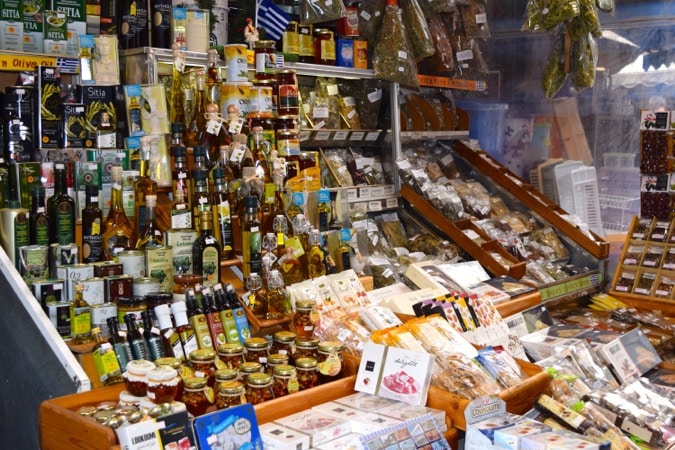
You are a GUI agent. You are given a task and a screenshot of the screen. Output one action in this format:
    pyautogui.click(x=<x>, y=<y>)
    Task: Click on the plastic baskets
    The height and width of the screenshot is (450, 675).
    Given the screenshot: What is the action you would take?
    pyautogui.click(x=537, y=175), pyautogui.click(x=549, y=187), pyautogui.click(x=564, y=188)